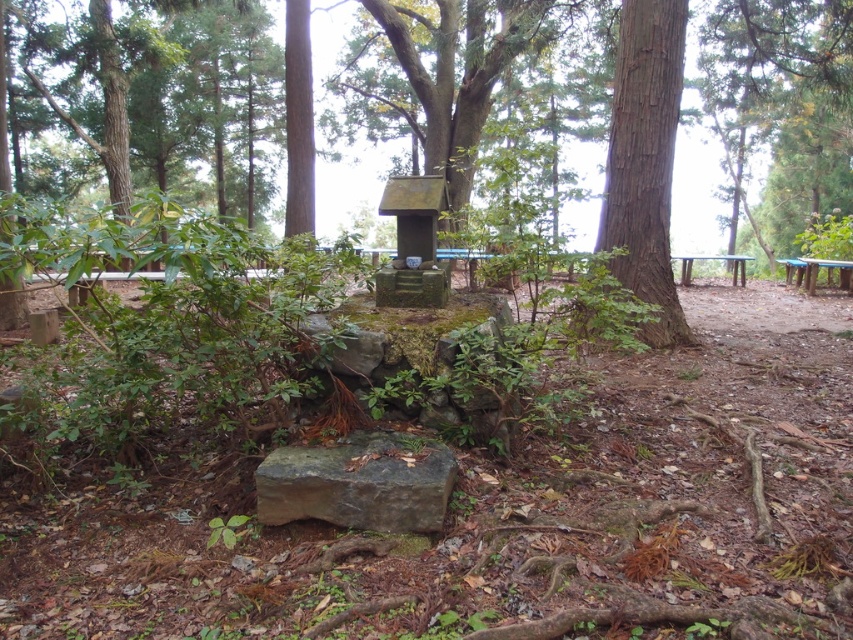
Is gray rough stone at center bigger than blue plastic picnic table at right?

No, gray rough stone at center is not bigger than blue plastic picnic table at right.

Who is more forward, (426, 497) or (781, 260)?

Point (426, 497)

You are a GUI agent. You are given a task and a screenshot of the screen. Output one action in this format:
    pyautogui.click(x=<x>, y=<y>)
    Task: Click on the gray rough stone at center
    The image size is (853, 640).
    Given the screenshot: What is the action you would take?
    pyautogui.click(x=358, y=483)

In the scene shown: Does blue plastic picnic table at right appear on the left side of wooden picnic table at right?

Incorrect, blue plastic picnic table at right is not on the left side of wooden picnic table at right.

Consider the image. Is blue plastic picnic table at right positioned in front of wooden picnic table at right?

Yes, it is in front of wooden picnic table at right.

Who is more forward, (850, 269) or (699, 259)?

Point (850, 269) is in front.

The image size is (853, 640). What are the coordinates of `blue plastic picnic table at right` in the screenshot? It's located at (816, 272).

Which is below, smooth brown tree trunk at right or gray rough stone at center?

gray rough stone at center

From the picture: Between smooth brown tree trunk at right and gray rough stone at center, which one appears on the right side from the viewer's perspective?

From the viewer's perspective, smooth brown tree trunk at right appears more on the right side.

Locate an element on the screen. smooth brown tree trunk at right is located at coordinates (645, 161).